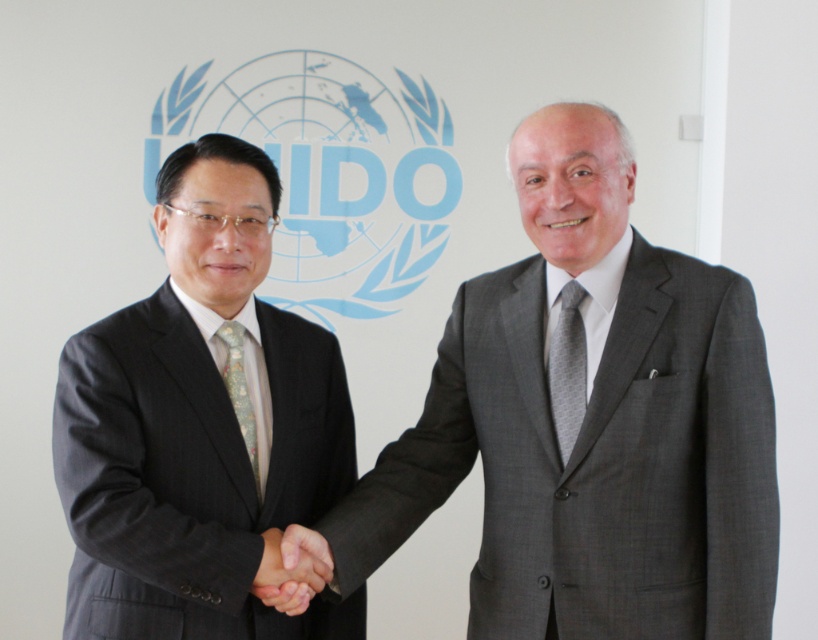
Question: Can you confirm if matte black suit at left is smaller than light blue floral silk tie at center?

Choices:
 (A) no
 (B) yes

Answer: (A)

Question: Which point is closer to the camera?

Choices:
 (A) matte black suit at left
 (B) gray textured suit at center
 (C) gray textured tie at center

Answer: (A)

Question: Is matte black suit at left to the left of light blue floral silk tie at center from the viewer's perspective?

Choices:
 (A) yes
 (B) no

Answer: (A)

Question: Estimate the real-world distances between objects in this image. Which object is farther from the light blue floral silk tie at center?

Choices:
 (A) gray textured tie at center
 (B) gray textured suit at center

Answer: (A)

Question: Which point is closer to the camera?

Choices:
 (A) (649, 611)
 (B) (565, 440)
 (C) (268, 556)
 (D) (250, 445)

Answer: (A)

Question: Considering the relative positions of black matte hand at center and light blue floral silk tie at center in the image provided, where is black matte hand at center located with respect to light blue floral silk tie at center?

Choices:
 (A) below
 (B) above

Answer: (A)